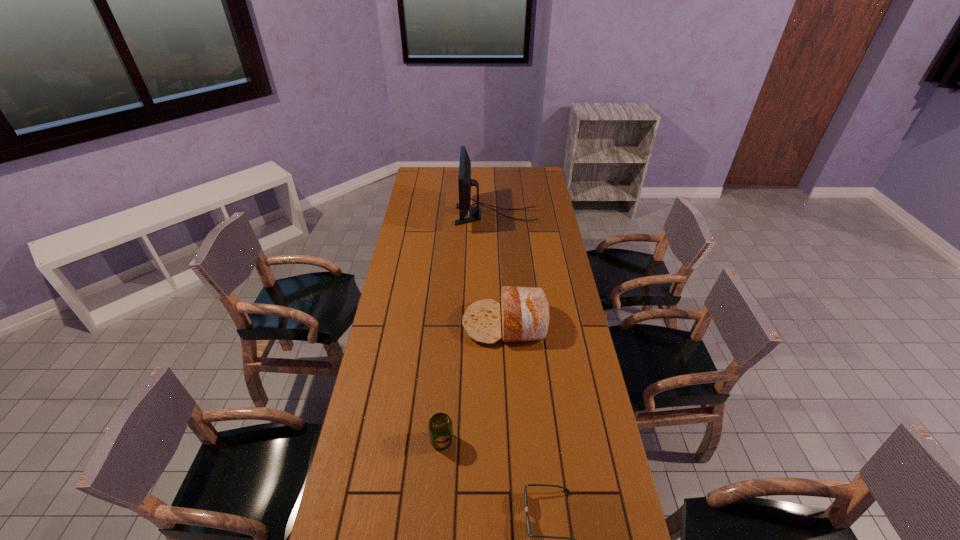
Identify the location of vacant space in between the farthest object and the bread. (500, 269).

Where is `object that ranks as the closest to the spectacles`? object that ranks as the closest to the spectacles is located at coordinates (440, 425).

Locate which object ranks second in proximity to the third nearest object. Please provide its 2D coordinates. Your answer should be formatted as a tuple, i.e. [(x, y)], where the tuple contains the x and y coordinates of a point satisfying the conditions above.

[(465, 182)]

Where is `vacant space that satisfies the following two spatial constraints: 1. on the screen side of the computer monitor; 2. on the front side of the second nearest object`? The width and height of the screenshot is (960, 540). vacant space that satisfies the following two spatial constraints: 1. on the screen side of the computer monitor; 2. on the front side of the second nearest object is located at coordinates (508, 441).